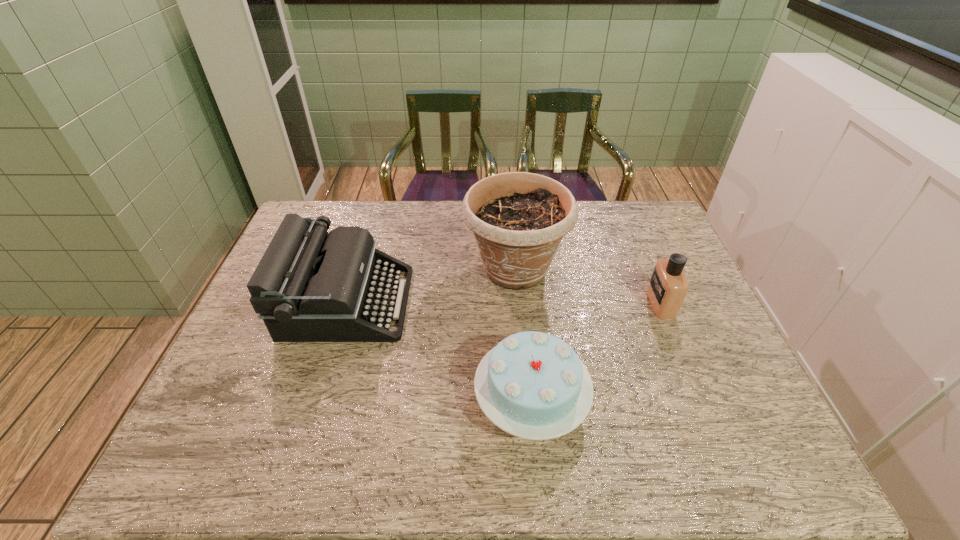
The height and width of the screenshot is (540, 960). I want to click on vacant space that satisfies the following two spatial constraints: 1. on the typing side of the birthday cake; 2. on the left side of the leftmost object, so click(x=319, y=400).

What are the coordinates of `free location that satisfies the following two spatial constraints: 1. on the front side of the tallest object; 2. on the typing side of the second tallest object` in the screenshot? It's located at 517,302.